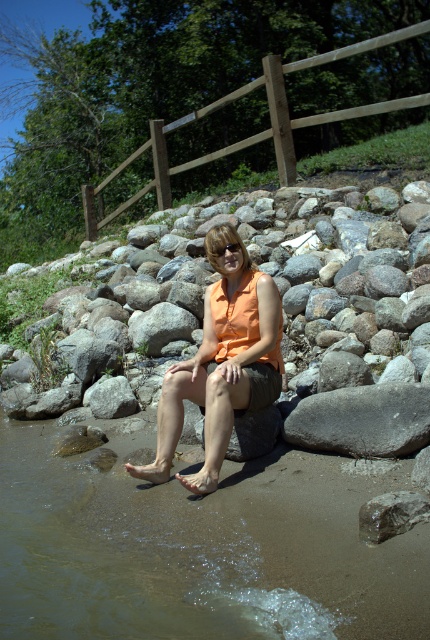
Question: Which of the following is the farthest from the observer?

Choices:
 (A) (371, 500)
 (B) (261, 285)

Answer: (B)

Question: Does gray smooth rock at lower right have a lesser width compared to transparent plastic goggles at center?

Choices:
 (A) yes
 (B) no

Answer: (B)

Question: Does orange fabric shirt at center appear under transparent plastic goggles at center?

Choices:
 (A) yes
 (B) no

Answer: (A)

Question: Among these points, which one is nearest to the camera?

Choices:
 (A) pyautogui.click(x=235, y=252)
 (B) pyautogui.click(x=372, y=497)
 (C) pyautogui.click(x=341, y=401)

Answer: (B)

Question: Which object appears closest to the camera in this image?

Choices:
 (A) gray smooth rock at lower right
 (B) orange fabric shirt at center
 (C) transparent plastic goggles at center
 (D) smooth gray rock at lower right

Answer: (D)

Question: Does orange fabric shirt at center have a larger size compared to smooth gray rock at lower right?

Choices:
 (A) no
 (B) yes

Answer: (B)